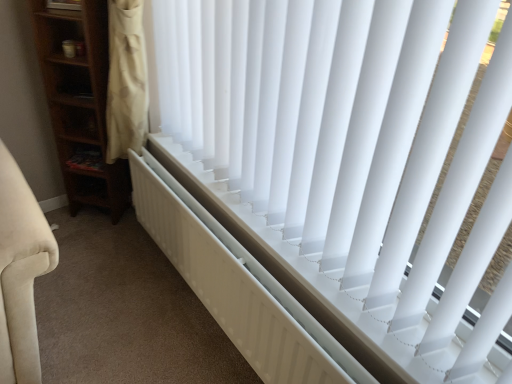
This screenshot has width=512, height=384. Describe the element at coordinates (85, 158) in the screenshot. I see `wooden shelf at left` at that location.

What do you see at coordinates (237, 286) in the screenshot? I see `white matte radiator at center` at bounding box center [237, 286].

Describe the element at coordinates (354, 160) in the screenshot. This screenshot has height=384, width=512. I see `white plastic blinds at center` at that location.

This screenshot has height=384, width=512. In order to click on wooden shelf at left in this screenshot , I will do `click(85, 158)`.

Are white plastic blinds at center and wooden shelf at left located far from each other?

white plastic blinds at center is positioned a significant distance from wooden shelf at left.

Which object is more forward, white plastic blinds at center or wooden shelf at left?

white plastic blinds at center.

Looking at this image, which object is wider, white plastic blinds at center or wooden shelf at left?

With larger width is white plastic blinds at center.

Is white plastic blinds at center oriented away from wooden shelf at left?

That's not correct — white plastic blinds at center is not looking away from wooden shelf at left.

Is white matte radiator at center positioned before wooden shelf at left?

Yes, white matte radiator at center is in front of wooden shelf at left.

The image size is (512, 384). I want to click on shelf behind the white matte radiator at center, so click(85, 158).

Is point (201, 245) closer to camera compared to point (66, 162)?

That is True.

Considering the relative sizes of white matte radiator at center and wooden shelf at left in the image provided, is white matte radiator at center wider than wooden shelf at left?

Incorrect, the width of white matte radiator at center does not surpass that of wooden shelf at left.

Is wooden shelf at left further to camera compared to white plastic blinds at center?

Yes, wooden shelf at left is further from the camera.

Is white plastic blinds at center located within wooden shelf at left?

No, white plastic blinds at center is located outside of wooden shelf at left.

Does wooden shelf at left have a greater width compared to white plastic blinds at center?

No.

From a real-world perspective, is wooden shelf at left positioned over white plastic blinds at center based on gravity?

Actually, wooden shelf at left is physically below white plastic blinds at center in the real world.

From a real-world perspective, is white matte radiator at center above or below white plastic blinds at center?

white matte radiator at center is below white plastic blinds at center.

Consider the image. Considering the relative positions of white matte radiator at center and white plastic blinds at center in the image provided, is white matte radiator at center behind white plastic blinds at center?

Yes, it is behind white plastic blinds at center.

In the scene shown: Considering the sizes of objects white matte radiator at center and white plastic blinds at center in the image provided, who is thinner, white matte radiator at center or white plastic blinds at center?

Thinner between the two is white matte radiator at center.

Where is `radiator lying below the white plastic blinds at center (from the image's perspective)`? radiator lying below the white plastic blinds at center (from the image's perspective) is located at coordinates (237, 286).

Who is taller, wooden shelf at left or white matte radiator at center?

With more height is white matte radiator at center.

In the scene shown: From the image's perspective, is wooden shelf at left above or below white matte radiator at center?

Clearly, from the image's perspective, wooden shelf at left is above white matte radiator at center.

Is wooden shelf at left positioned beyond the bounds of white matte radiator at center?

wooden shelf at left is positioned outside white matte radiator at center.

How distant is wooden shelf at left from white matte radiator at center?

A distance of 29.46 inches exists between wooden shelf at left and white matte radiator at center.

Is white plastic blinds at center positioned beyond the bounds of white matte radiator at center?

Indeed, white plastic blinds at center is completely outside white matte radiator at center.

Looking at this image, from their relative heights in the image, would you say white plastic blinds at center is taller or shorter than white matte radiator at center?

Considering their sizes, white plastic blinds at center has more height than white matte radiator at center.

The width and height of the screenshot is (512, 384). I want to click on radiator below the white plastic blinds at center (from the image's perspective), so click(237, 286).

Which is less distant, [189,21] or [251,270]?

The point [251,270] is closer.

The height and width of the screenshot is (384, 512). I want to click on shelf below the white plastic blinds at center (from the image's perspective), so click(x=85, y=158).

This screenshot has width=512, height=384. I want to click on shelf above the white matte radiator at center (from a real-world perspective), so click(85, 158).

Based on their spatial positions, is white matte radiator at center or white plastic blinds at center further from wooden shelf at left?

white plastic blinds at center.

When comparing their distances from white plastic blinds at center, does wooden shelf at left or white matte radiator at center seem further?

Based on the image, wooden shelf at left appears to be further to white plastic blinds at center.

Which object lies further to the anchor point white plastic blinds at center, white matte radiator at center or wooden shelf at left?

wooden shelf at left lies further to white plastic blinds at center than the other object.

Looking at the image, which one is located further to white matte radiator at center, wooden shelf at left or white plastic blinds at center?

wooden shelf at left lies further to white matte radiator at center than the other object.

When comparing their distances from white matte radiator at center, does white plastic blinds at center or wooden shelf at left seem further?

wooden shelf at left lies further to white matte radiator at center than the other object.

Considering their positions, is white plastic blinds at center positioned further to wooden shelf at left than white matte radiator at center?

The object further to wooden shelf at left is white plastic blinds at center.

Locate an element on the screen. Image resolution: width=512 pixels, height=384 pixels. radiator between white plastic blinds at center and wooden shelf at left in the front-back direction is located at coordinates (237, 286).